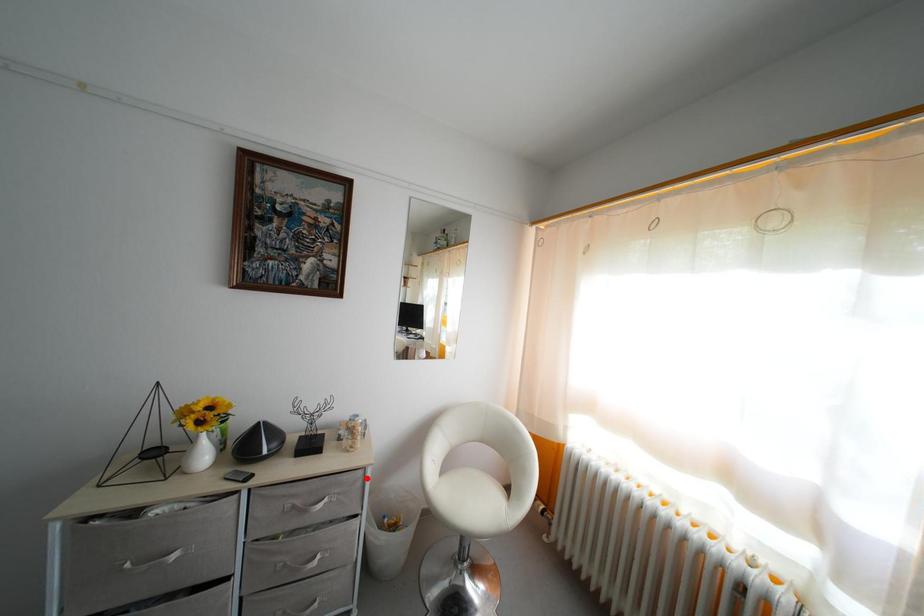
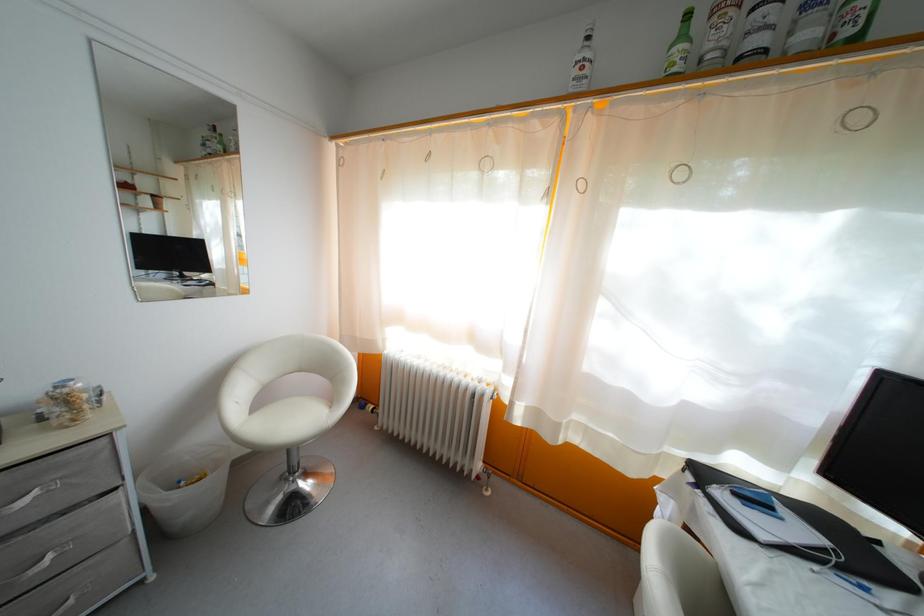
Question: A red point is marked in image1. In image2, is the corresponding 3D point closer to the camera or farther? Reply with the corresponding letter.

Choices:
 (A) The corresponding 3D point is closer.
 (B) The corresponding 3D point is farther.

Answer: (A)